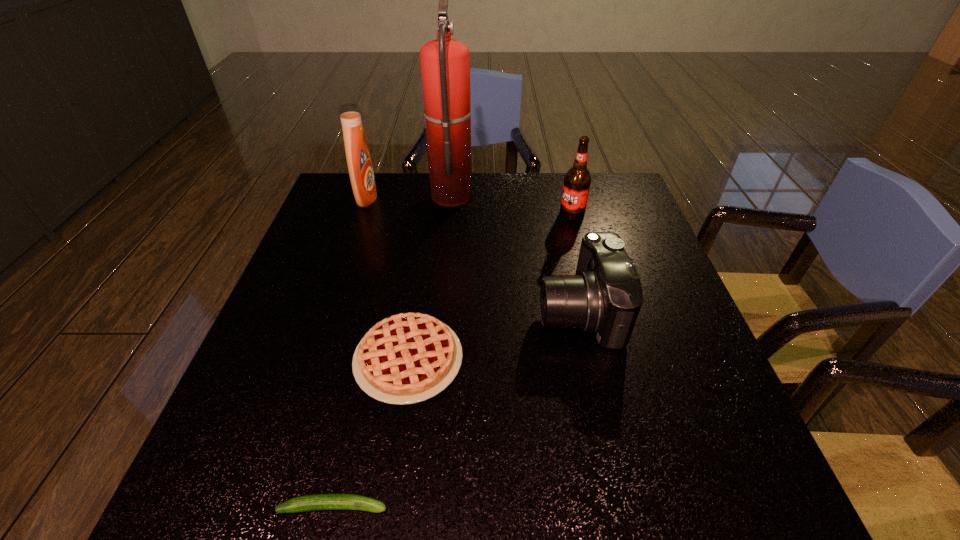
This screenshot has height=540, width=960. What are the coordinates of `unoccupied position between the tallest object and the root beer` in the screenshot? It's located at (512, 204).

Identify the location of free point between the root beer and the fifth shortest object. (469, 206).

I want to click on vacant area that lies between the fire extinguisher and the fourth shortest object, so click(x=512, y=204).

You are a GUI agent. You are given a task and a screenshot of the screen. Output one action in this format:
    pyautogui.click(x=<x>, y=<y>)
    Task: Click on the empty space between the nearest object and the detergent
    This screenshot has width=960, height=540.
    Given the screenshot: What is the action you would take?
    pyautogui.click(x=350, y=352)

The image size is (960, 540). What are the coordinates of `empty space that is in between the second shortest object and the tallest object` in the screenshot? It's located at (430, 276).

The image size is (960, 540). Identify the location of free area in between the detergent and the tallest object. (409, 196).

This screenshot has width=960, height=540. What are the coordinates of `free area in between the fifth tallest object and the fire extinguisher` in the screenshot? It's located at (430, 276).

In order to click on vacant space that's between the fire extinguisher and the detergent in this screenshot , I will do `click(409, 196)`.

Locate an element on the screen. This screenshot has width=960, height=540. object that stands as the closest to the tallest object is located at coordinates (359, 163).

Identify which object is the second closest to the fourth shortest object. Please provide its 2D coordinates. Your answer should be formatted as a tuple, i.e. [(x, y)], where the tuple contains the x and y coordinates of a point satisfying the conditions above.

[(445, 63)]